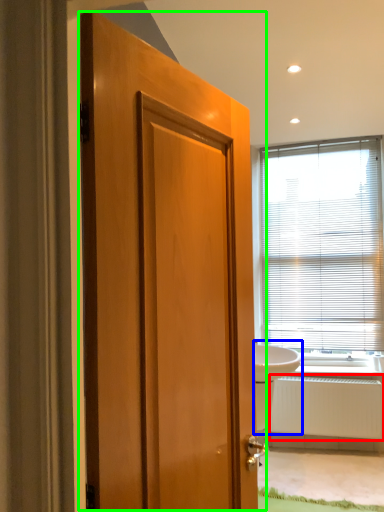
Question: Based on their relative distances, which object is farther from radiator (highlighted by a red box)? Choose from sink (highlighted by a blue box) and door (highlighted by a green box).

Choices:
 (A) sink
 (B) door

Answer: (B)